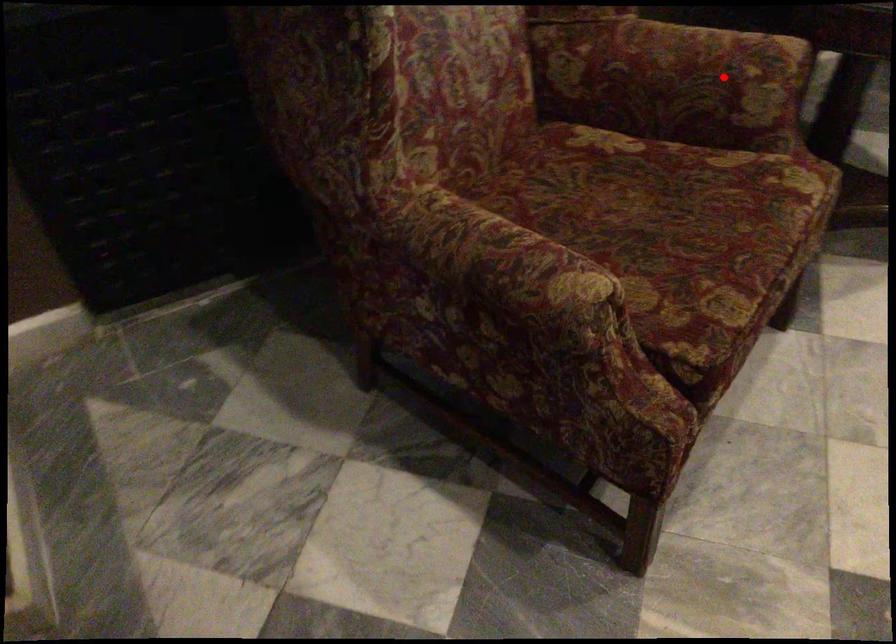
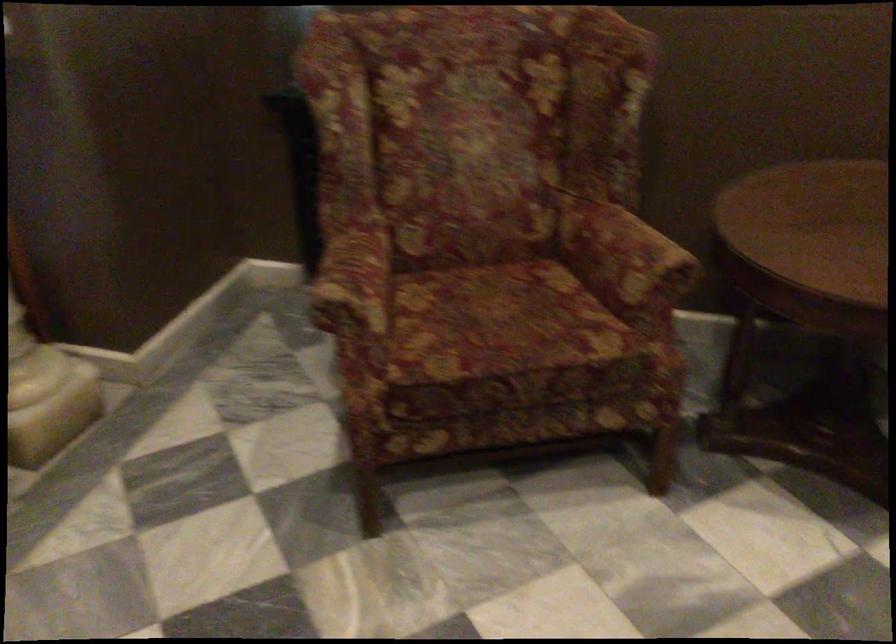
Question: I am providing you with two images of the same scene from different viewpoints. Image1 has a red point marked. In image2, the corresponding 3D location appears at what relative position? Reply with the corresponding letter.

Choices:
 (A) Closer
 (B) Farther

Answer: (B)